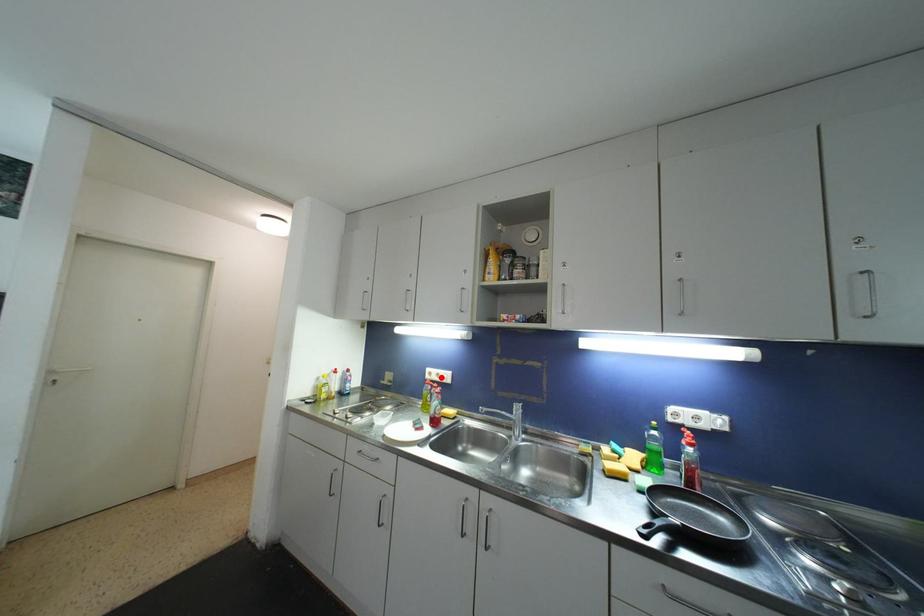
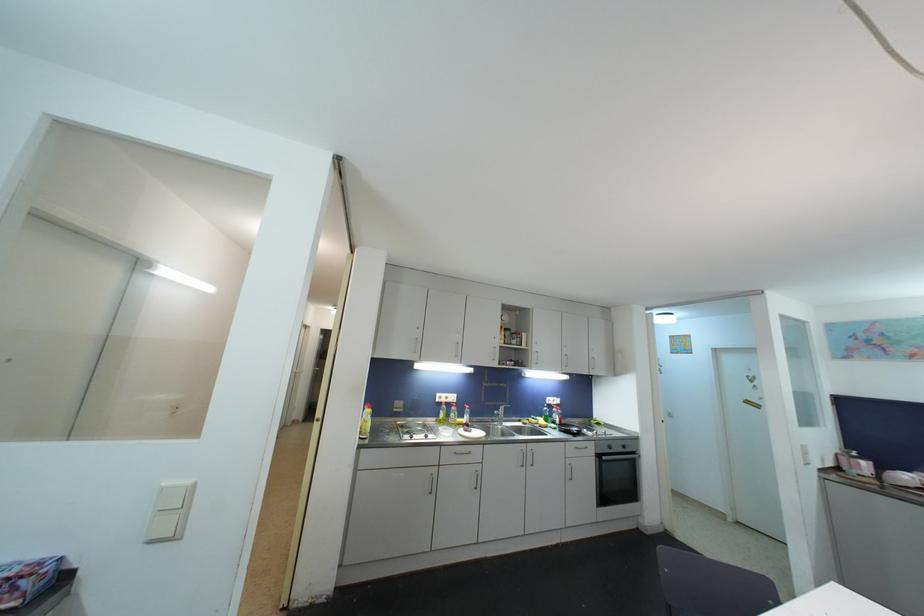
Question: I am providing you with two images of the same scene from different viewpoints. Image1 has a red point marked. In image2, the corresponding 3D location appears at what relative position? Reply with the corresponding letter.

Choices:
 (A) Closer
 (B) Farther

Answer: (B)